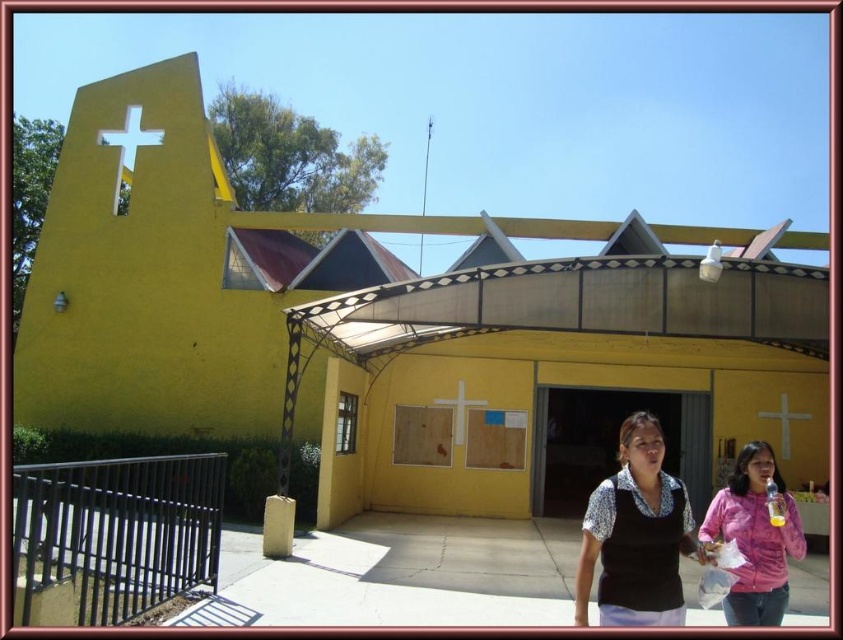
Question: Is white matte cross at upper center positioned behind white matte cross at center?

Choices:
 (A) yes
 (B) no

Answer: (B)

Question: Which object appears closest to the camera in this image?

Choices:
 (A) yellow matte building at center
 (B) white matte cross at center
 (C) pink fabric shirt at lower right

Answer: (C)

Question: Which of these objects is positioned farthest from the white matte cross at upper left?

Choices:
 (A) pink fabric shirt at lower right
 (B) matte black blouse at center
 (C) yellow matte building at center
 (D) white matte cross at center

Answer: (A)

Question: Can you confirm if white matte cross at upper left is thinner than white matte cross at center?

Choices:
 (A) no
 (B) yes

Answer: (A)

Question: Does pink fabric shirt at lower right have a larger size compared to white matte cross at center?

Choices:
 (A) no
 (B) yes

Answer: (B)

Question: Which object is positioned farthest from the white matte cross at upper center?

Choices:
 (A) white matte cross at upper left
 (B) yellow matte building at center
 (C) matte black blouse at center

Answer: (A)